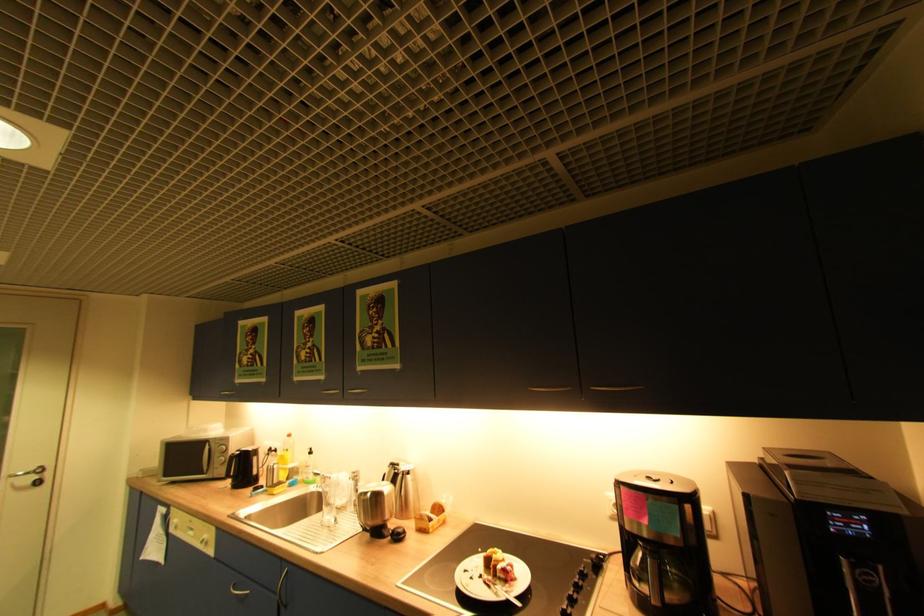
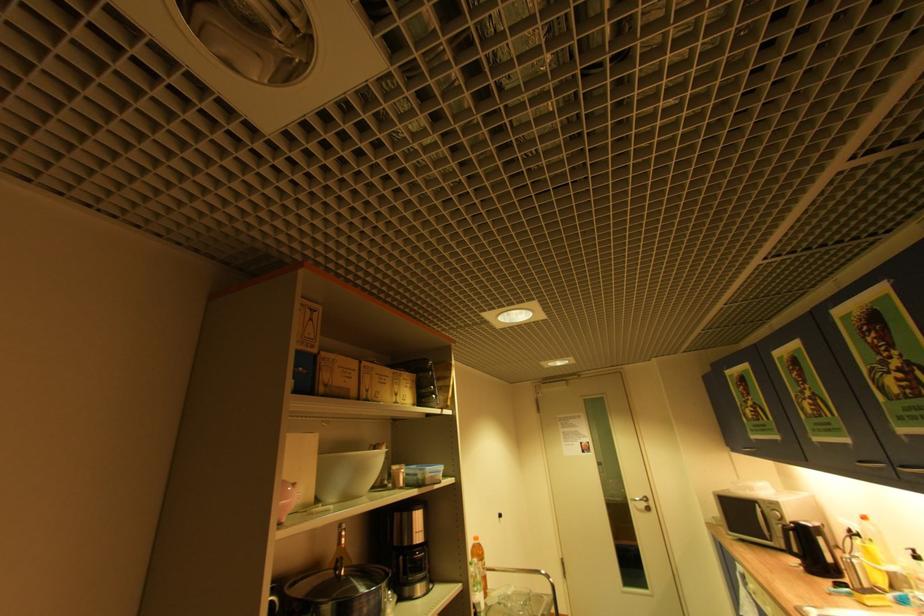
The point at (x=275, y=450) is marked in the first image. Where is the corresponding point in the second image?

(856, 532)